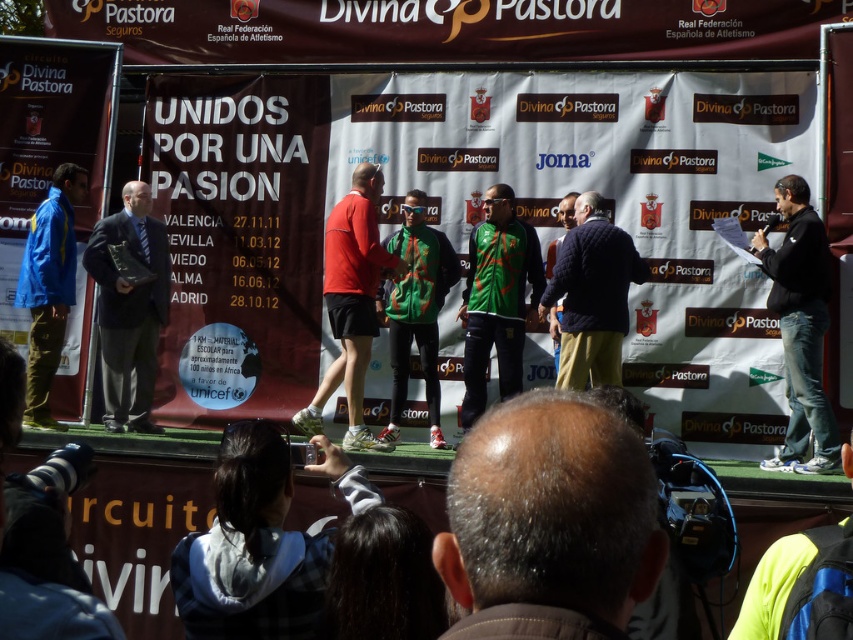
You are standing at the center of the stage and want to hand a medal to the person wearing the navy quilted jacket at center. In which direction should you move to reach them?

The navy quilted jacket at center is located at point 0.464 on the x and 0.695 on the y, so you should move towards the lower right direction to reach them.

You are a photographer at the event and need to capture a photo of both the navy quilted jacket at center and the navy blue sweater at center. Which one should you focus on first if you want to ensure both are in the frame without moving the camera?

You should focus on the navy quilted jacket at center first because it is positioned under the navy blue sweater at center, meaning it is closer to the camera. By focusing on the closer object first, you can ensure both are in the frame without needing to adjust the camera position.